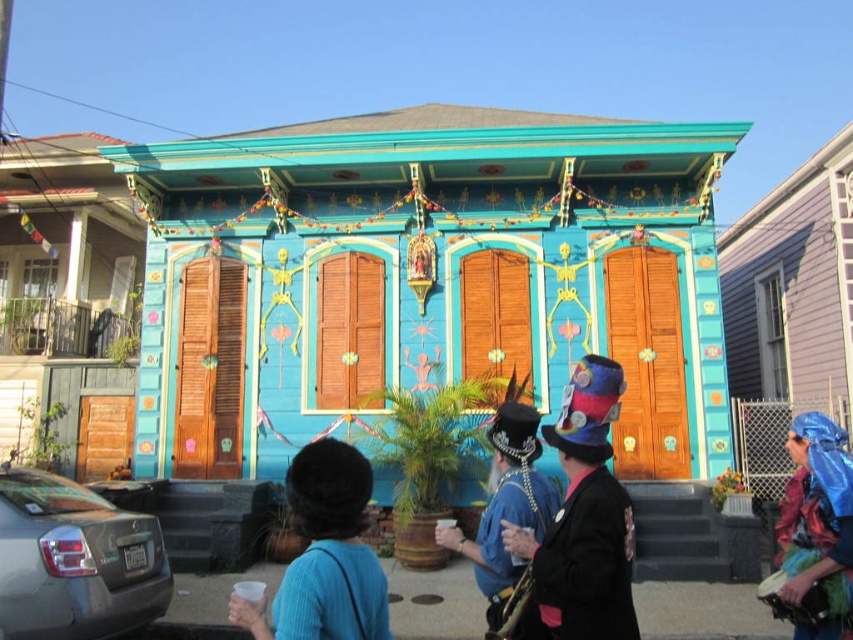
Question: Can you confirm if gray metallic car at lower left is positioned below velvet multicolored hat at center?

Choices:
 (A) yes
 (B) no

Answer: (A)

Question: Which of these objects is positioned farthest from the blue velvet hat at center?

Choices:
 (A) blue fabric hat at center
 (B) blue shiny fabric at lower right

Answer: (B)

Question: Can you confirm if blue fabric hat at center is positioned below blue shiny fabric at lower right?

Choices:
 (A) yes
 (B) no

Answer: (B)

Question: Among these points, which one is nearest to the camera?

Choices:
 (A) (38, 589)
 (B) (820, 452)

Answer: (A)

Question: Is velvet multicolored hat at center to the left of blue shiny fabric at lower right from the viewer's perspective?

Choices:
 (A) no
 (B) yes

Answer: (B)

Question: Estimate the real-world distances between objects in this image. Which object is closer to the blue velvet hat at center?

Choices:
 (A) gray metallic car at lower left
 (B) blue shiny fabric at lower right
 (C) velvet multicolored hat at center

Answer: (C)